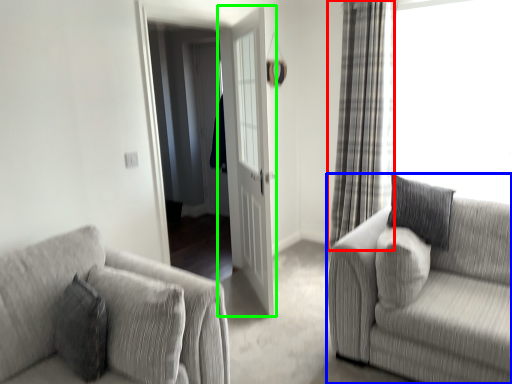
Question: Which object is positioned closest to curtain (highlighted by a red box)? Select from studio couch (highlighted by a blue box) and door (highlighted by a green box).

Choices:
 (A) studio couch
 (B) door

Answer: (B)